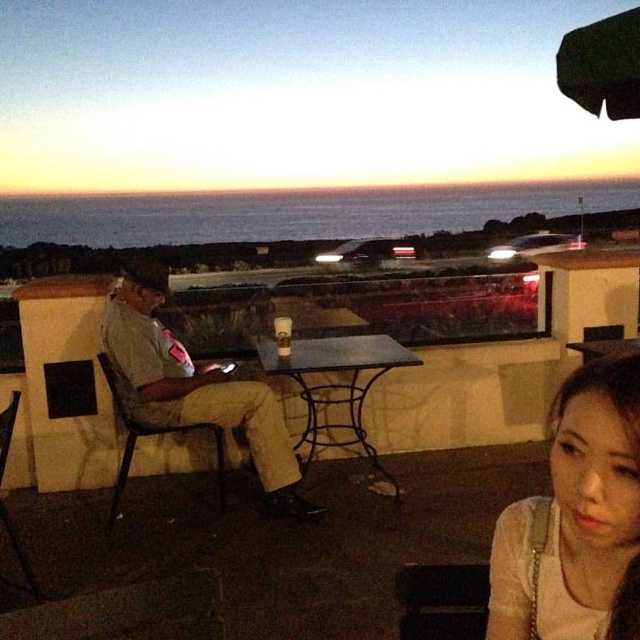
You are standing in the outdoor setting and want to hand a drink to the person wearing the smooth white blouse at lower right. Which direction should you approach from relative to the matte gray shirt at left?

You should approach from the direction of the matte gray shirt at left because the smooth white blouse at lower right is closer to the viewer than the matte gray shirt at left, meaning the blouse is positioned in front of the shirt. Therefore, approaching from the side of the matte gray shirt at left would allow you to reach the person more directly.

You are a photographer trying to capture the sunset while ensuring both the smooth white blouse at lower right and the matte gray shirt at left are visible in the frame. Which direction should you move to include both items in your shot?

To include both the smooth white blouse at lower right and the matte gray shirt at left in your shot, you should move to the left side since the smooth white blouse at lower right is on the right side of the matte gray shirt at left.

Looking at this image, you are a delivery robot with a 2.5 meter long package. You need to place the package between the smooth white blouse at lower right and the metallic black table at center. Is there enough space between them to fit the package?

The distance between the smooth white blouse at lower right and the metallic black table at center is 2.66 meters. Since the package is 2.5 meters long, there is sufficient space to fit it between them.